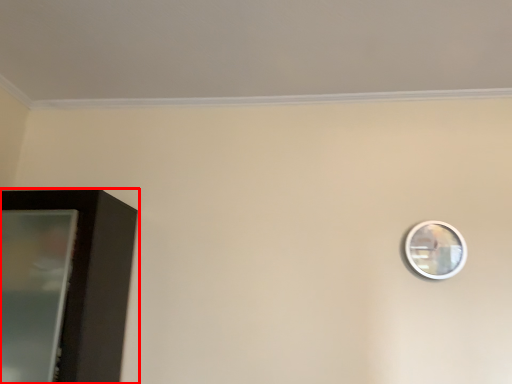
Question: From the image's perspective, considering the relative positions of furniture (annotated by the red box) and mirror in the image provided, where is furniture (annotated by the red box) located with respect to the staircase?

Choices:
 (A) above
 (B) below

Answer: (B)